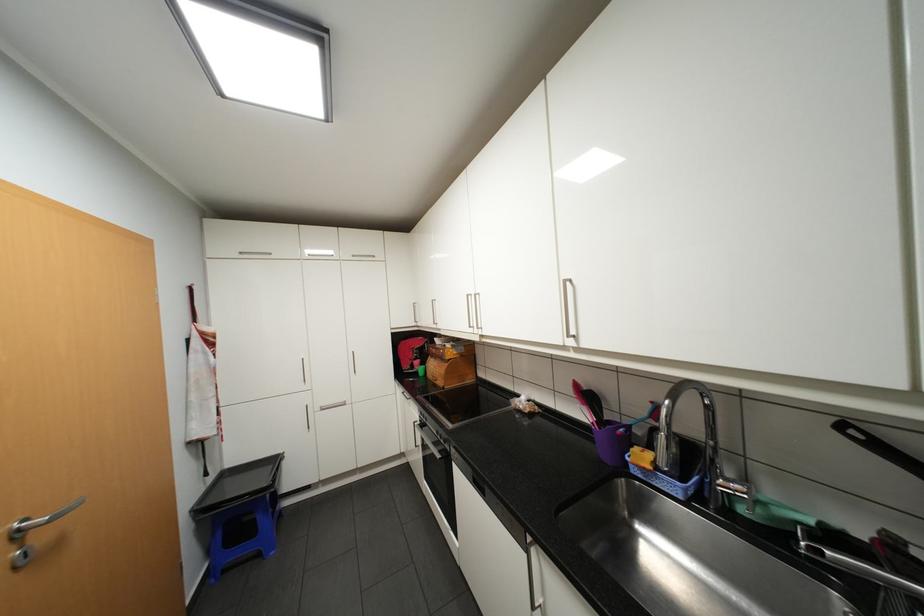
The location [610,426] corresponds to which object?

This point indicates the purple utensil holder.